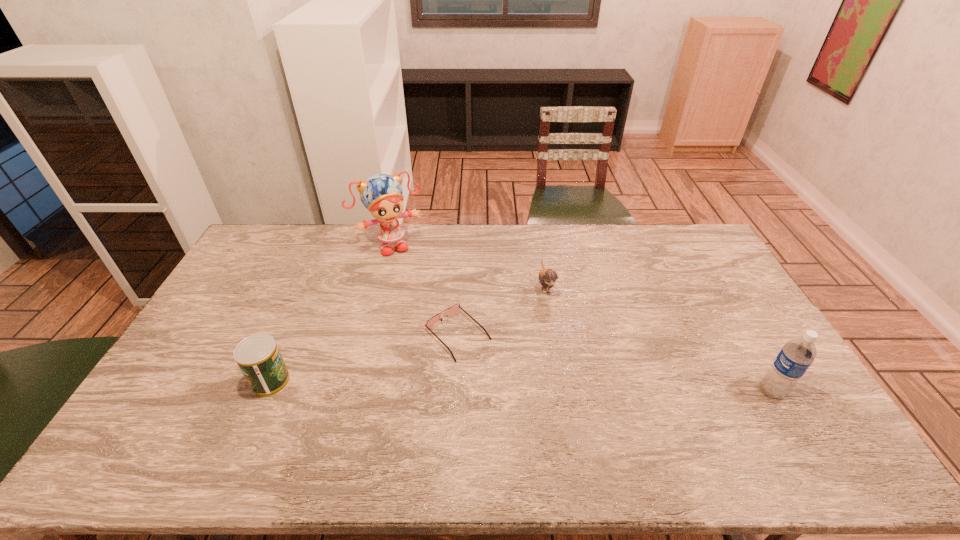
Identify the location of vacant spot on the desktop that is between the third shortest object and the rightmost object and is positioned on the face of the tallest object. (463, 385).

Locate an element on the screen. The height and width of the screenshot is (540, 960). free spot on the desktop that is between the can and the water bottle and is positioned on the bridge of the sunglasses is located at coordinates (511, 386).

Locate an element on the screen. vacant space on the desktop that is between the leftmost object and the fourth shortest object and is positioned on the front-facing side of the fourth nearest object is located at coordinates (582, 388).